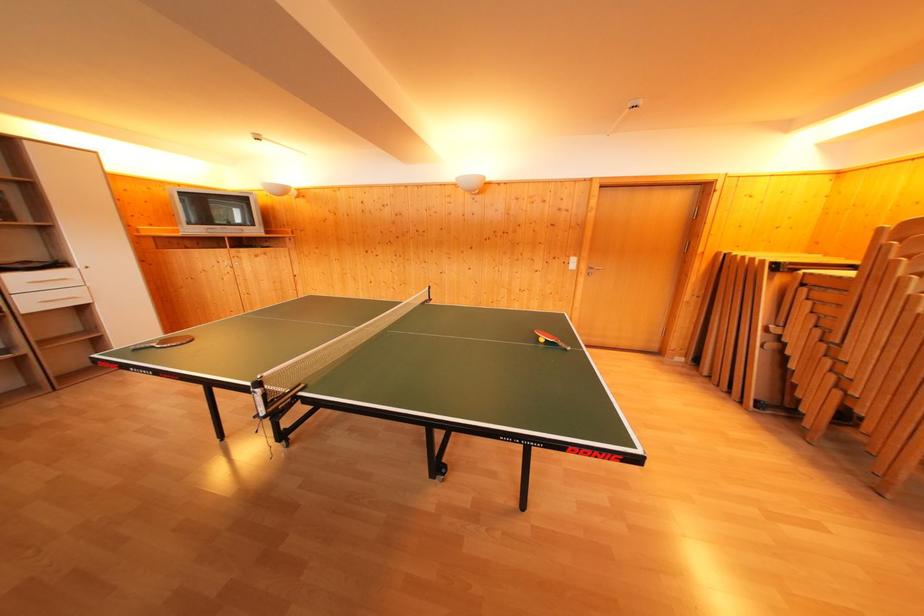
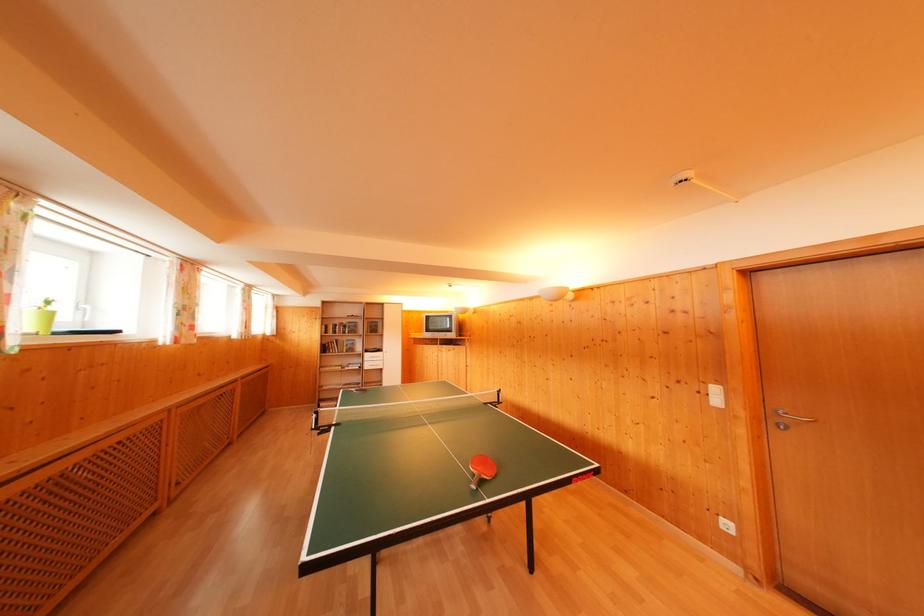
The point at (578,265) is marked in the first image. Where is the corresponding point in the second image?

(721, 395)